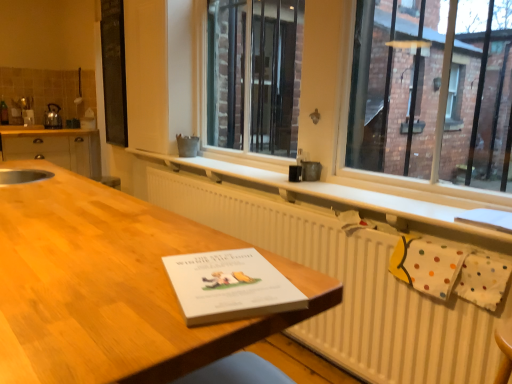
Identify the location of vacant space that is to the left of white paper at center. (105, 287).